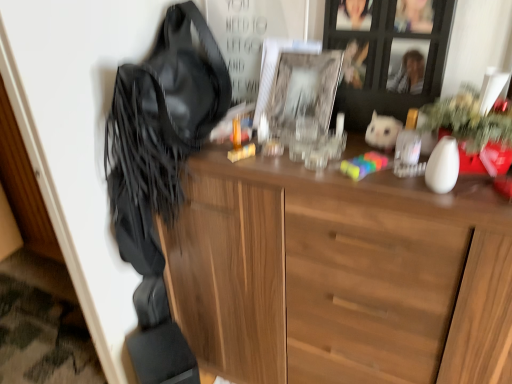
This screenshot has height=384, width=512. In order to click on leather fringe at left in this screenshot , I will do `click(160, 143)`.

The image size is (512, 384). What do you see at coordinates (383, 131) in the screenshot?
I see `white plush toy at upper right` at bounding box center [383, 131].

What do you see at coordinates (386, 62) in the screenshot? This screenshot has height=384, width=512. I see `wooden cabinet at upper center` at bounding box center [386, 62].

The height and width of the screenshot is (384, 512). Describe the element at coordinates (302, 90) in the screenshot. I see `clear glass picture frame at center` at that location.

The width and height of the screenshot is (512, 384). What are the coordinates of `leather fringe at left` in the screenshot? It's located at (160, 143).

From a real-world perspective, which object stands above the other?

leather fringe at left, from a real-world perspective.

Can you confirm if leather fringe at left is bigger than white plush toy at upper right?

Correct, leather fringe at left is larger in size than white plush toy at upper right.

Is leather fringe at left inside or outside of white plush toy at upper right?

leather fringe at left cannot be found inside white plush toy at upper right.

Does leather fringe at left come in front of white plush toy at upper right?

Yes, leather fringe at left is in front of white plush toy at upper right.

How many degrees apart are the facing directions of wooden cabinet at upper center and clear glass picture frame at center?

They differ by 2.9 degrees in their facing directions.

Image resolution: width=512 pixels, height=384 pixels. Identify the location of picture frame below the wooden cabinet at upper center (from the image's perspective). point(302,90).

From a real-world perspective, does wooden cabinet at upper center sit lower than clear glass picture frame at center?

Incorrect, from a real-world perspective, wooden cabinet at upper center is higher than clear glass picture frame at center.

Who is shorter, clear glass picture frame at center or leather fringe at left?

clear glass picture frame at center is shorter.

From the image's perspective, which object appears higher, clear glass picture frame at center or leather fringe at left?

From the image's view, clear glass picture frame at center is above.

From a real-world perspective, is clear glass picture frame at center physically above leather fringe at left?

Yes, from a real-world perspective, clear glass picture frame at center is above leather fringe at left.

Do you think white plush toy at upper right is within clear glass picture frame at center, or outside of it?

white plush toy at upper right is outside clear glass picture frame at center.

Based on their positions, is white plush toy at upper right located to the left or right of clear glass picture frame at center?

white plush toy at upper right is to the right of clear glass picture frame at center.

From the image's perspective, is white plush toy at upper right beneath clear glass picture frame at center?

Yes, from the image's perspective, white plush toy at upper right is below clear glass picture frame at center.

Measure the distance from white plush toy at upper right to clear glass picture frame at center.

white plush toy at upper right is 7.30 inches from clear glass picture frame at center.

Does white plush toy at upper right have a smaller size compared to wooden cabinet at upper center?

Yes.

In the scene shown: Is white plush toy at upper right positioned behind wooden cabinet at upper center?

Yes, white plush toy at upper right is further from the camera.

Is point (400, 123) less distant than point (395, 102)?

Yes, point (400, 123) is closer to viewer.

Looking at this image, from a real-world perspective, is white plush toy at upper right located beneath wooden cabinet at upper center?

Yes.

Could you tell me if leather fringe at left is turned towards clear glass picture frame at center?

No, leather fringe at left is not aimed at clear glass picture frame at center.

From the image's perspective, is leather fringe at left below clear glass picture frame at center?

Indeed, from the image's perspective, leather fringe at left is shown beneath clear glass picture frame at center.

Considering the relative positions of leather fringe at left and clear glass picture frame at center in the image provided, is leather fringe at left to the left of clear glass picture frame at center from the viewer's perspective?

Correct, you'll find leather fringe at left to the left of clear glass picture frame at center.

From a real-world perspective, relative to clear glass picture frame at center, is leather fringe at left vertically above or below?

leather fringe at left is below clear glass picture frame at center.

Looking at this image, is clear glass picture frame at center directly adjacent to wooden cabinet at upper center?

No.

Based on their sizes in the image, would you say clear glass picture frame at center is bigger or smaller than wooden cabinet at upper center?

Considering their sizes, clear glass picture frame at center takes up less space than wooden cabinet at upper center.

From a real-world perspective, who is located lower, clear glass picture frame at center or wooden cabinet at upper center?

clear glass picture frame at center, from a real-world perspective.

In terms of width, does clear glass picture frame at center look wider or thinner when compared to wooden cabinet at upper center?

Clearly, clear glass picture frame at center has more width compared to wooden cabinet at upper center.

Where is `animal behind the leather fringe at left`? animal behind the leather fringe at left is located at coordinates (383, 131).

At what (x,y) coordinates should I click in order to perform the action: click on picture frame that is below the wooden cabinet at upper center (from the image's perspective). Please return your answer as a coordinate pair (x, y). The height and width of the screenshot is (384, 512). Looking at the image, I should click on [x=302, y=90].

Considering their positions, is clear glass picture frame at center positioned further to white plush toy at upper right than leather fringe at left?

Among the two, leather fringe at left is located further to white plush toy at upper right.

Which object lies nearer to the anchor point wooden cabinet at upper center, leather fringe at left or clear glass picture frame at center?

clear glass picture frame at center.

Estimate the real-world distances between objects in this image. Which object is further from leather fringe at left, clear glass picture frame at center or white plush toy at upper right?

white plush toy at upper right.

From the image, which object appears to be nearer to white plush toy at upper right, wooden cabinet at upper center or leather fringe at left?

Based on the image, wooden cabinet at upper center appears to be nearer to white plush toy at upper right.

Which object lies nearer to the anchor point white plush toy at upper right, wooden cabinet at upper center or clear glass picture frame at center?

wooden cabinet at upper center is closer to white plush toy at upper right.

Based on their spatial positions, is wooden cabinet at upper center or leather fringe at left closer to clear glass picture frame at center?

wooden cabinet at upper center lies closer to clear glass picture frame at center than the other object.

From the picture: Considering their positions, is white plush toy at upper right positioned closer to wooden cabinet at upper center than leather fringe at left?

Among the two, white plush toy at upper right is located nearer to wooden cabinet at upper center.

Which object lies further to the anchor point leather fringe at left, white plush toy at upper right or wooden cabinet at upper center?

Based on the image, white plush toy at upper right appears to be further to leather fringe at left.

At what (x,y) coordinates should I click in order to perform the action: click on cabinetry situated between clear glass picture frame at center and white plush toy at upper right from left to right. Please return your answer as a coordinate pair (x, y). Image resolution: width=512 pixels, height=384 pixels. Looking at the image, I should click on (386, 62).

Where is `picture frame situated between leather fringe at left and wooden cabinet at upper center from left to right`? The width and height of the screenshot is (512, 384). picture frame situated between leather fringe at left and wooden cabinet at upper center from left to right is located at coordinates (302, 90).

I want to click on cabinetry between leather fringe at left and white plush toy at upper right, so click(x=386, y=62).

You are a GUI agent. You are given a task and a screenshot of the screen. Output one action in this format:
    pyautogui.click(x=<x>, y=<y>)
    Task: Click on the picture frame between leather fringe at left and white plush toy at upper right in the horizontal direction
    This screenshot has height=384, width=512.
    Given the screenshot: What is the action you would take?
    pyautogui.click(x=302, y=90)